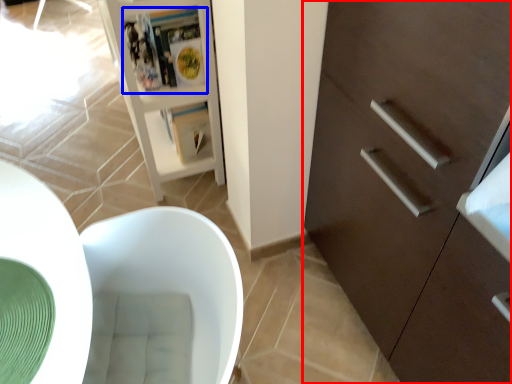
Question: Which object is further to the camera taking this photo, cabinetry (highlighted by a red box) or magazine (highlighted by a blue box)?

Choices:
 (A) cabinetry
 (B) magazine

Answer: (B)